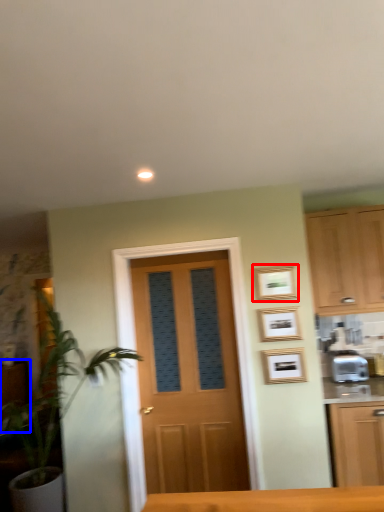
Question: Which object is further to the camera taking this photo, picture frame (highlighted by a red box) or cabinetry (highlighted by a blue box)?

Choices:
 (A) picture frame
 (B) cabinetry

Answer: (B)